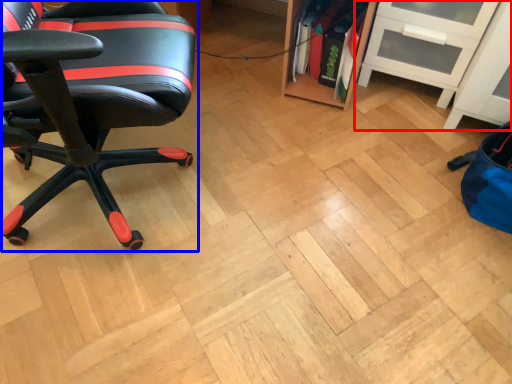
Question: Which of the following is the farthest to the observer, shelf (highlighted by a red box) or chair (highlighted by a blue box)?

Choices:
 (A) shelf
 (B) chair

Answer: (A)